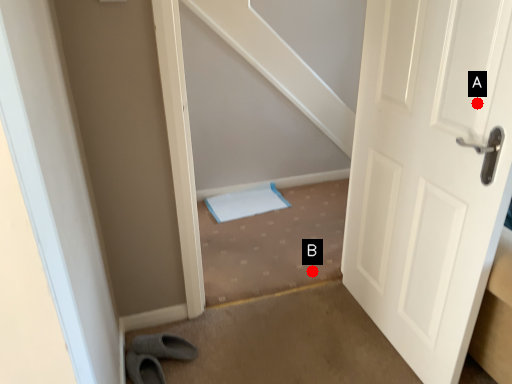
Question: Two points are circled on the image, labeled by A and B beside each circle. Which of the following is the farthest from the observer?

Choices:
 (A) A is further
 (B) B is further

Answer: (B)